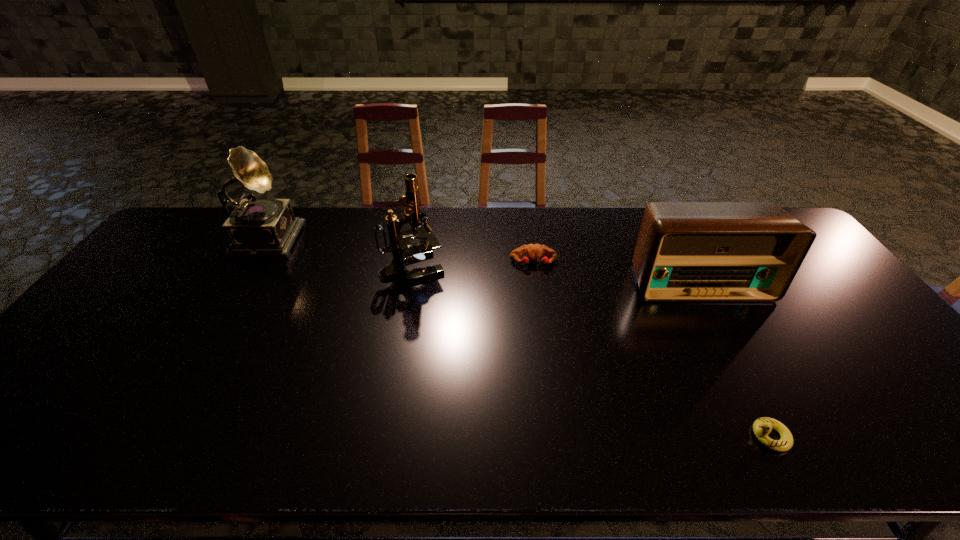
Identify the location of vacant area located on the face of the nearest object. The width and height of the screenshot is (960, 540). (666, 436).

Locate an element on the screen. This screenshot has height=540, width=960. vacant space located on the face of the nearest object is located at coordinates (574, 436).

This screenshot has width=960, height=540. Identify the location of object present at the far edge. (256, 227).

At what (x,y) coordinates should I click in order to perform the action: click on object that is at the near edge. Please return your answer as a coordinate pair (x, y). The height and width of the screenshot is (540, 960). Looking at the image, I should click on (762, 427).

You are a GUI agent. You are given a task and a screenshot of the screen. Output one action in this format:
    pyautogui.click(x=<x>, y=<y>)
    Task: Click on the free point at the far edge
    The height and width of the screenshot is (540, 960).
    Given the screenshot: What is the action you would take?
    pyautogui.click(x=316, y=218)

In the image, there is a desktop. Find the location of `free region at the near edge`. free region at the near edge is located at coordinates (146, 441).

Locate an element on the screen. This screenshot has width=960, height=540. blank space at the left edge is located at coordinates (103, 383).

Image resolution: width=960 pixels, height=540 pixels. What are the coordinates of `free region at the right edge` in the screenshot? It's located at (886, 355).

What are the coordinates of `free space at the far left corner of the desktop` in the screenshot? It's located at (164, 245).

Find the location of a particular element. This screenshot has height=540, width=960. vacant area that lies between the duckling and the third object from right to left is located at coordinates (652, 349).